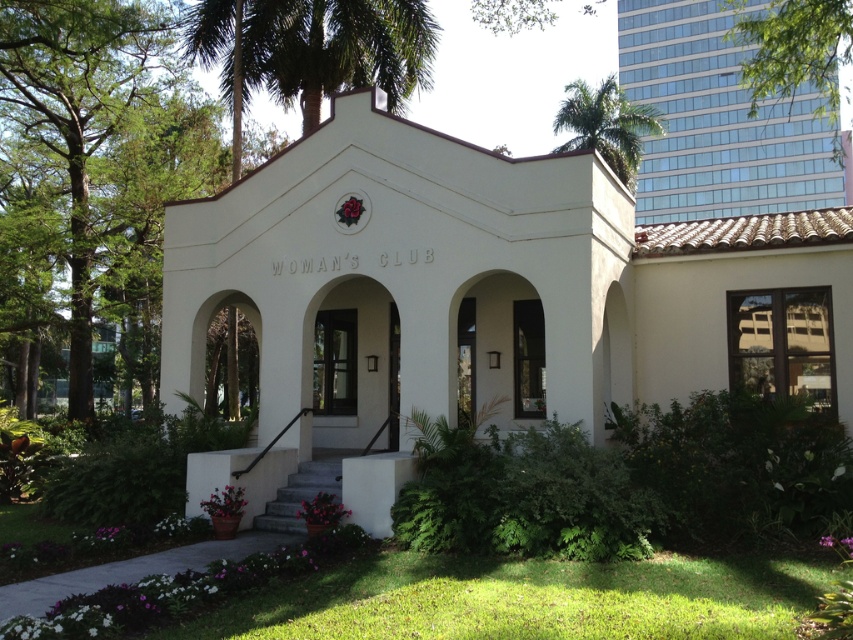
Which is above, green leafy tree at upper right or green leafy palm tree at upper right?

green leafy palm tree at upper right

Is point (755, 67) positioned behind point (585, 136)?

No, it is in front of (585, 136).

The image size is (853, 640). Find the location of `green leafy tree at upper right`. green leafy tree at upper right is located at coordinates (793, 52).

Who is positioned more to the right, white stucco chapel at center or glassy steel skyscraper at upper right?

glassy steel skyscraper at upper right

Does white stucco chapel at center have a smaller size compared to glassy steel skyscraper at upper right?

Indeed, white stucco chapel at center has a smaller size compared to glassy steel skyscraper at upper right.

The width and height of the screenshot is (853, 640). What are the coordinates of `white stucco chapel at center` in the screenshot? It's located at (479, 300).

Between glassy steel skyscraper at upper right and green leafy palm tree at upper center, which one appears on the right side from the viewer's perspective?

glassy steel skyscraper at upper right is more to the right.

What do you see at coordinates (717, 122) in the screenshot?
I see `glassy steel skyscraper at upper right` at bounding box center [717, 122].

Image resolution: width=853 pixels, height=640 pixels. In order to click on glassy steel skyscraper at upper right in this screenshot , I will do `click(717, 122)`.